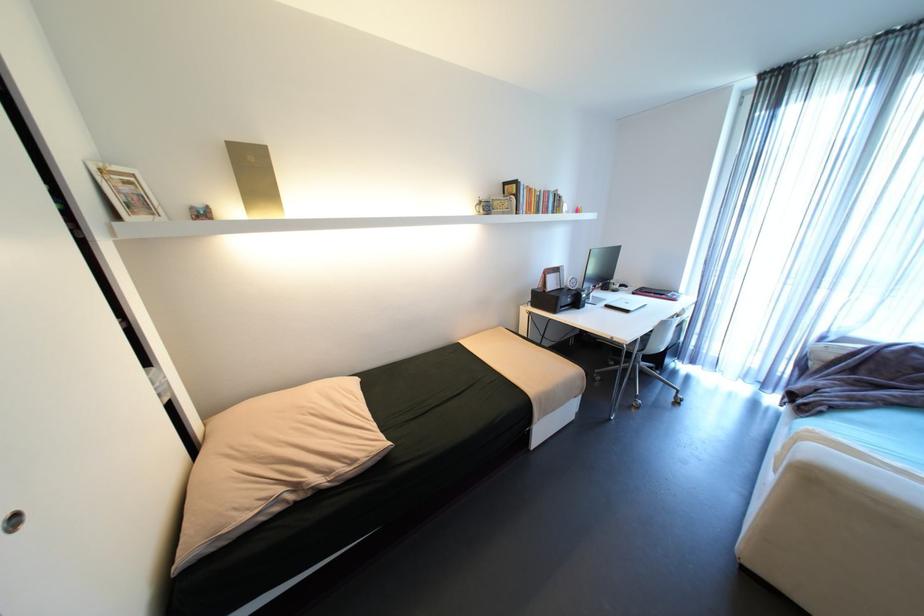
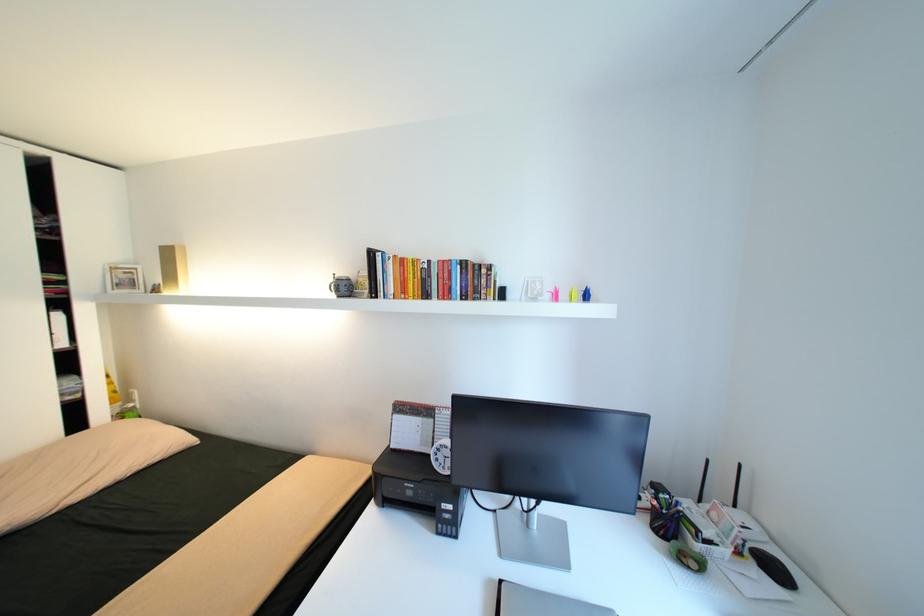
In the second image, find the point that corresponds to (x=207, y=206) in the first image.

(164, 284)